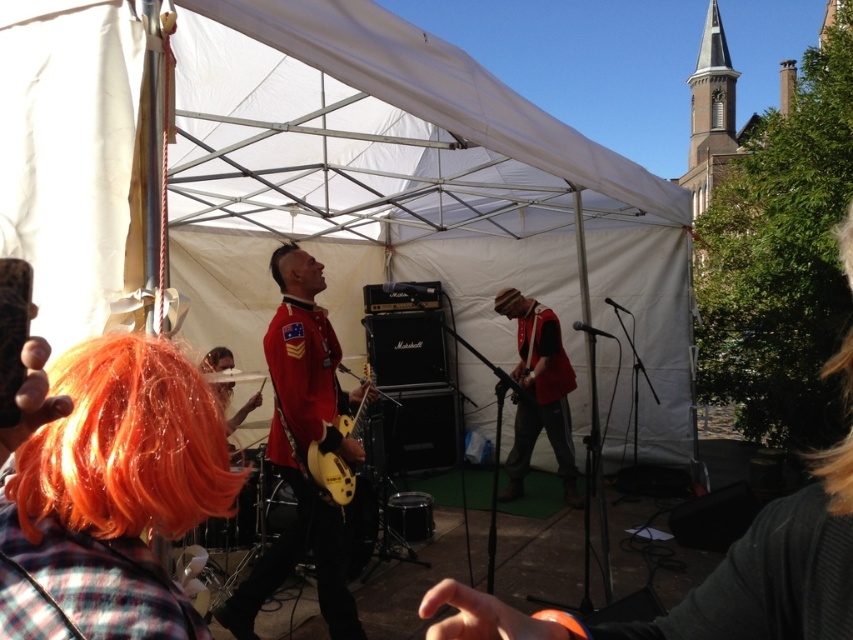
Question: Can you confirm if shiny red uniform at center is positioned below yellow matte guitar at center?

Choices:
 (A) yes
 (B) no

Answer: (A)

Question: Is red velvet vest at center smaller than dark brown hair at center?

Choices:
 (A) yes
 (B) no

Answer: (B)

Question: Which point is farther from the camera taking this photo?

Choices:
 (A) (190, 406)
 (B) (317, 172)

Answer: (B)

Question: Which point is closer to the camera?

Choices:
 (A) (135, 337)
 (B) (184, 252)

Answer: (A)

Question: Estimate the real-world distances between objects in this image. Which object is farther from the white fabric tent at center?

Choices:
 (A) yellow matte guitar at center
 (B) matte red vest at center
 (C) dark brown hair at center

Answer: (C)

Question: Can you confirm if red velvet vest at center is positioned above shiny gold guitar at center?

Choices:
 (A) no
 (B) yes

Answer: (B)